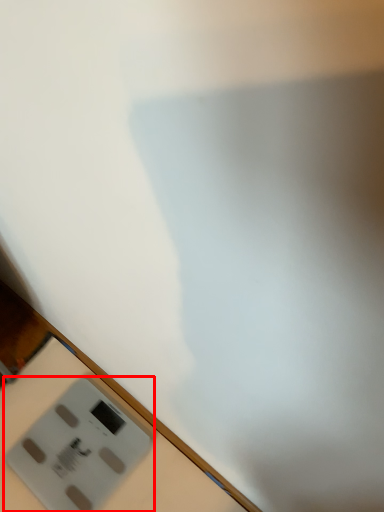
Question: From the image's perspective, where is power plugs and sockets (annotated by the red box) located in relation to table in the image?

Choices:
 (A) below
 (B) above

Answer: (B)